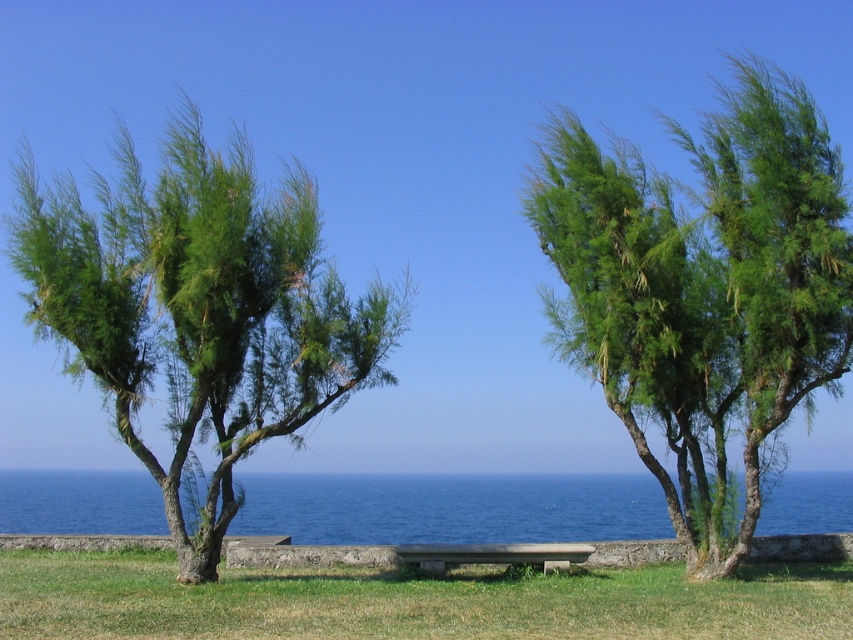
What do you see at coordinates (198, 310) in the screenshot?
I see `green leafy tree at left` at bounding box center [198, 310].

Is point (229, 486) farther from camera compared to point (843, 525)?

That is False.

Which is behind, point (187, 486) or point (498, 493)?

Positioned behind is point (498, 493).

At what (x,y) coordinates should I click in order to perform the action: click on green leafy tree at left. Please return your answer as a coordinate pair (x, y). The height and width of the screenshot is (640, 853). Looking at the image, I should click on (198, 310).

Can you confirm if blue liquid water at center is bigger than smooth gray bench at center?

Yes, blue liquid water at center is bigger than smooth gray bench at center.

Between blue liquid water at center and smooth gray bench at center, which one is positioned lower?

blue liquid water at center is below.

What do you see at coordinates (451, 508) in the screenshot? I see `blue liquid water at center` at bounding box center [451, 508].

Where is `blue liquid water at center`? This screenshot has width=853, height=640. blue liquid water at center is located at coordinates (451, 508).

How distant is green leafy tree at left from smooth gray bench at center?

They are 2.66 meters apart.

Find the location of a particular element. The height and width of the screenshot is (640, 853). green leafy tree at left is located at coordinates (198, 310).

Identify the location of green leafy tree at left. The height and width of the screenshot is (640, 853). point(198,310).